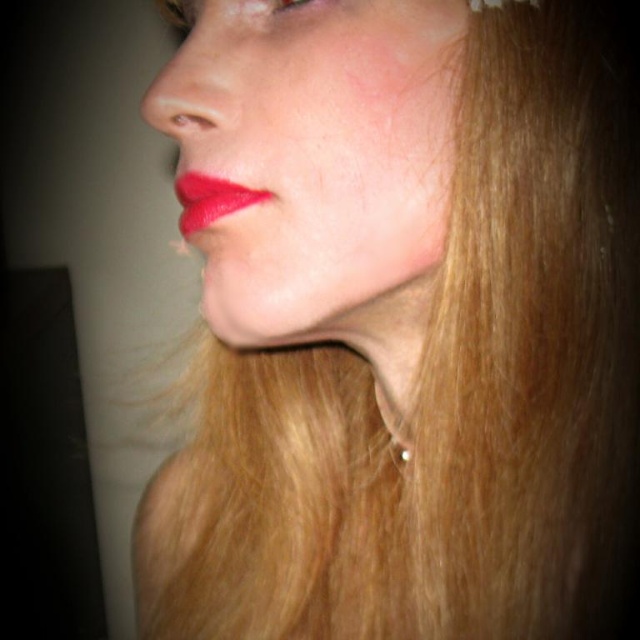
Question: Does matte red lips at center appear on the left side of pearl-like earring at center?

Choices:
 (A) no
 (B) yes

Answer: (B)

Question: Which of the following is the closest to the observer?

Choices:
 (A) (408, 452)
 (B) (208, 212)

Answer: (B)

Question: Is matte red lips at center below pearl-like earring at center?

Choices:
 (A) no
 (B) yes

Answer: (A)

Question: Does matte red lips at center have a lesser width compared to pearl-like earring at center?

Choices:
 (A) no
 (B) yes

Answer: (A)

Question: Which point is closer to the camera?

Choices:
 (A) matte red lips at center
 (B) pearl-like earring at center

Answer: (A)